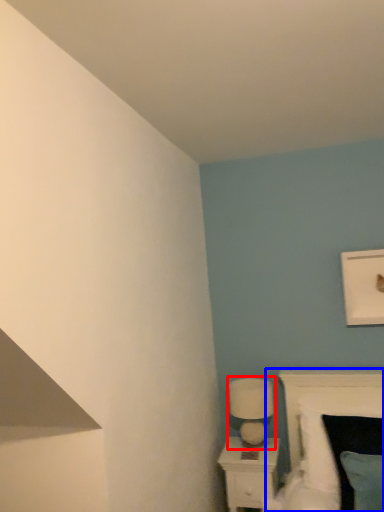
Question: Which object appears closest to the camera in this image, table lamp (highlighted by a red box) or bed (highlighted by a blue box)?

Choices:
 (A) table lamp
 (B) bed

Answer: (B)